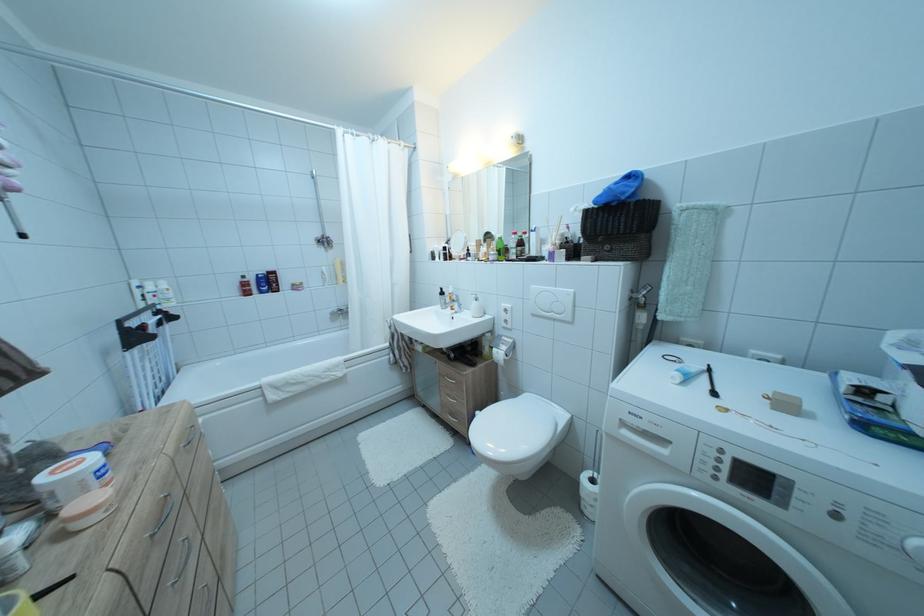
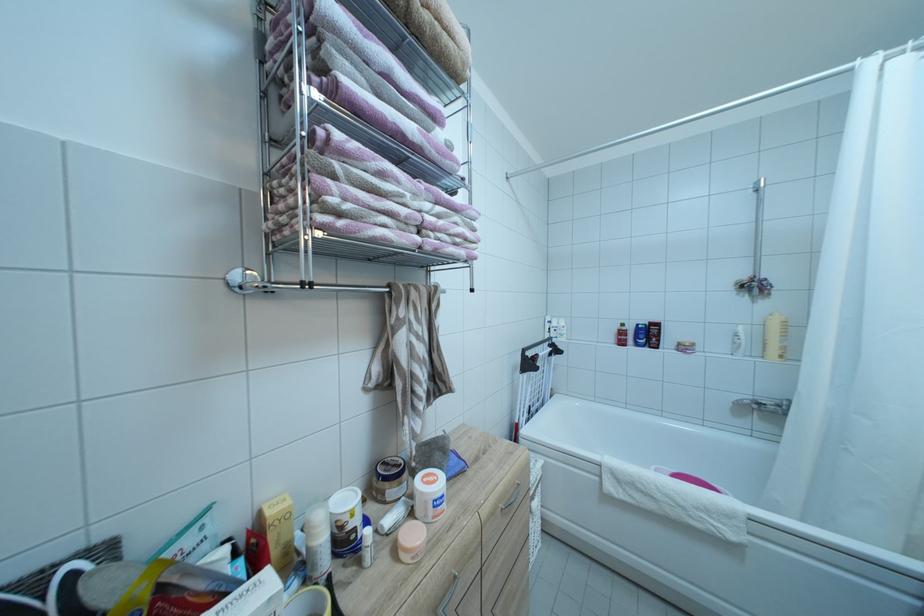
Where in the second image is the point corresponding to point (347, 285) from the first image?

(781, 357)